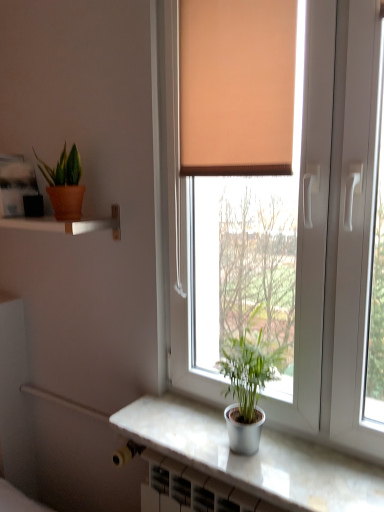
Question: From their relative heights in the image, would you say orange fabric curtain at upper center is taller or shorter than white plastic window at center?

Choices:
 (A) short
 (B) tall

Answer: (A)

Question: Considering the positions of orange fabric curtain at upper center and white plastic window at center in the image, is orange fabric curtain at upper center bigger or smaller than white plastic window at center?

Choices:
 (A) small
 (B) big

Answer: (A)

Question: Based on their relative distances, which object is farther from the matte terracotta pot at upper left, the 2th houseplant when ordered from bottom to top?

Choices:
 (A) white plastic window at center
 (B) silver metallic pot at window, which is counted as the 1th houseplant, starting from the right
 (C) matte white shelf at upper left
 (D) white marble counter top at lower center
 (E) orange fabric curtain at upper center

Answer: (D)

Question: Estimate the real-world distances between objects in this image. Which object is farther from the white plastic window at center?

Choices:
 (A) matte white shelf at upper left
 (B) matte terracotta pot at upper left, which ranks as the first houseplant in left-to-right order
 (C) silver metallic pot at window, the 2th houseplant when ordered from back to front
 (D) white marble counter top at lower center
 (E) orange fabric curtain at upper center

Answer: (B)